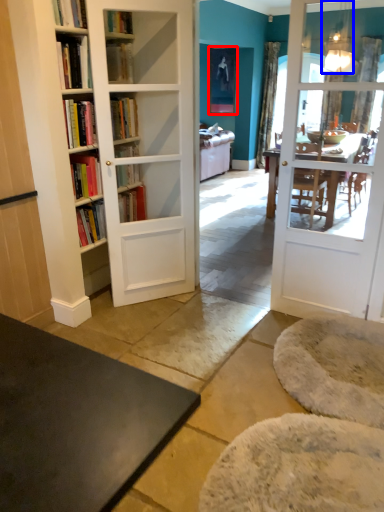
Question: Which object is further to the camera taking this photo, picture frame (highlighted by a red box) or lamp (highlighted by a blue box)?

Choices:
 (A) picture frame
 (B) lamp

Answer: (A)